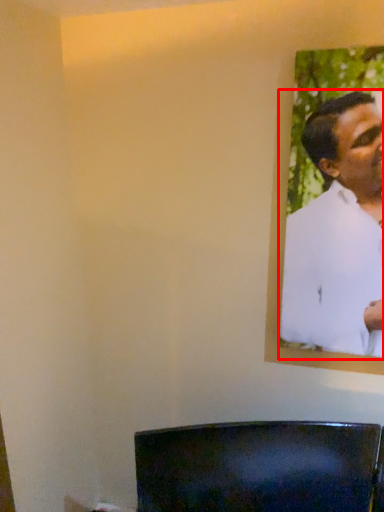
Question: Considering the relative positions of man (annotated by the red box) and furniture in the image provided, where is man (annotated by the red box) located with respect to the staircase?

Choices:
 (A) left
 (B) right

Answer: (B)